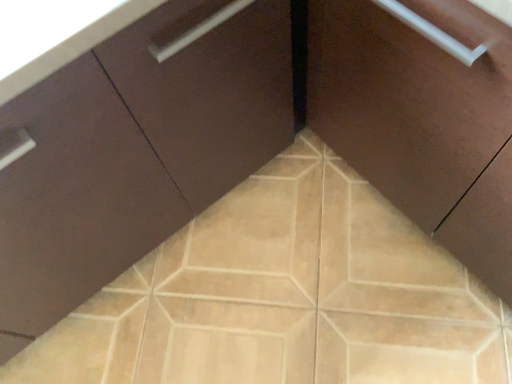
Question: Should I look upward or downward to see beige ceramic tile at center?

Choices:
 (A) down
 (B) up

Answer: (A)

Question: Would you say beige ceramic tile at center contains matte brown cabinet at center, which appears as the 1th cabinetry when viewed from the left?

Choices:
 (A) no
 (B) yes

Answer: (A)

Question: Is beige ceramic tile at center outside of matte brown cabinet at center, the 2th cabinetry viewed from the right?

Choices:
 (A) yes
 (B) no

Answer: (A)

Question: Does beige ceramic tile at center have a greater width compared to matte brown cabinet at center, which appears as the 1th cabinetry when viewed from the left?

Choices:
 (A) no
 (B) yes

Answer: (B)

Question: Is beige ceramic tile at center with matte brown cabinet at center, which appears as the 1th cabinetry when viewed from the left?

Choices:
 (A) yes
 (B) no

Answer: (B)

Question: Is beige ceramic tile at center facing away from matte brown cabinet at center, which appears as the 1th cabinetry when viewed from the left?

Choices:
 (A) no
 (B) yes

Answer: (A)

Question: Is beige ceramic tile at center further to camera compared to matte brown cabinet at center, which appears as the 1th cabinetry when viewed from the left?

Choices:
 (A) yes
 (B) no

Answer: (A)

Question: From the image's perspective, is matte brown cabinet at center, arranged as the 1th cabinetry when viewed from the right, located beneath beige ceramic tile at center?

Choices:
 (A) no
 (B) yes

Answer: (A)

Question: Does matte brown cabinet at center, arranged as the 1th cabinetry when viewed from the right, turn towards beige ceramic tile at center?

Choices:
 (A) yes
 (B) no

Answer: (A)

Question: Is matte brown cabinet at center, which is the second cabinetry from left to right, positioned before beige ceramic tile at center?

Choices:
 (A) no
 (B) yes

Answer: (B)

Question: From a real-world perspective, is matte brown cabinet at center, which is the second cabinetry from left to right, under beige ceramic tile at center?

Choices:
 (A) no
 (B) yes

Answer: (A)

Question: Can you confirm if matte brown cabinet at center, arranged as the 1th cabinetry when viewed from the right, is taller than beige ceramic tile at center?

Choices:
 (A) no
 (B) yes

Answer: (B)

Question: Considering the relative sizes of matte brown cabinet at center, arranged as the 1th cabinetry when viewed from the right, and beige ceramic tile at center in the image provided, is matte brown cabinet at center, arranged as the 1th cabinetry when viewed from the right, bigger than beige ceramic tile at center?

Choices:
 (A) no
 (B) yes

Answer: (B)

Question: Is matte brown cabinet at center, which is the second cabinetry from left to right, further to camera compared to matte brown cabinet at center, the 2th cabinetry viewed from the right?

Choices:
 (A) no
 (B) yes

Answer: (B)